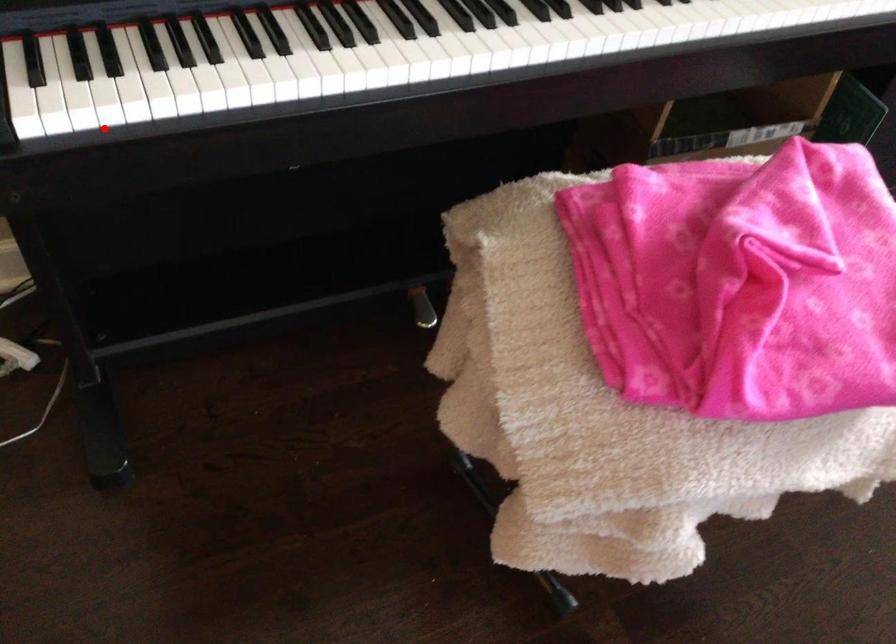
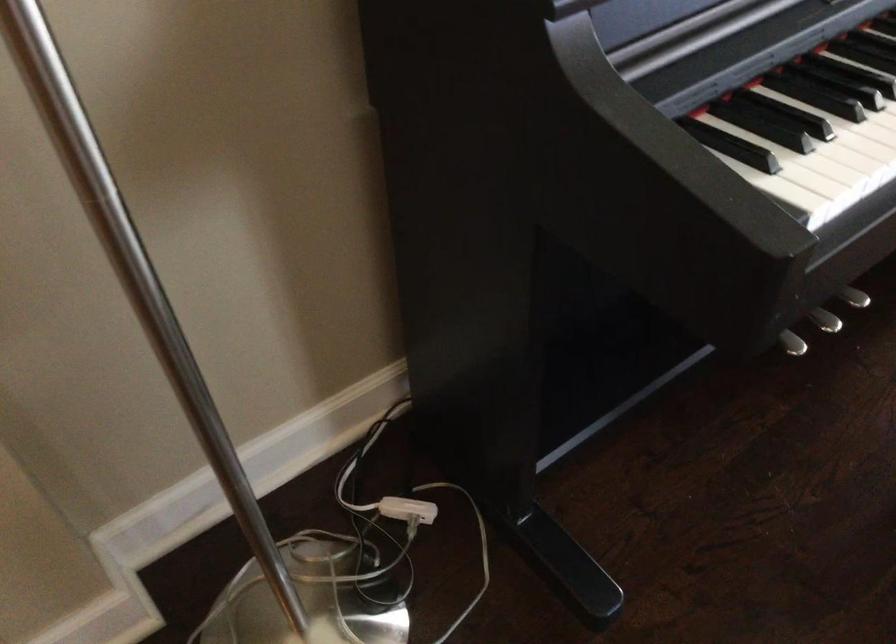
Question: I am providing you with two images of the same scene from different viewpoints. Image1 has a red point marked. In image2, the corresponding 3D location appears at what relative position? Reply with the corresponding letter.

Choices:
 (A) Closer
 (B) Farther

Answer: (A)